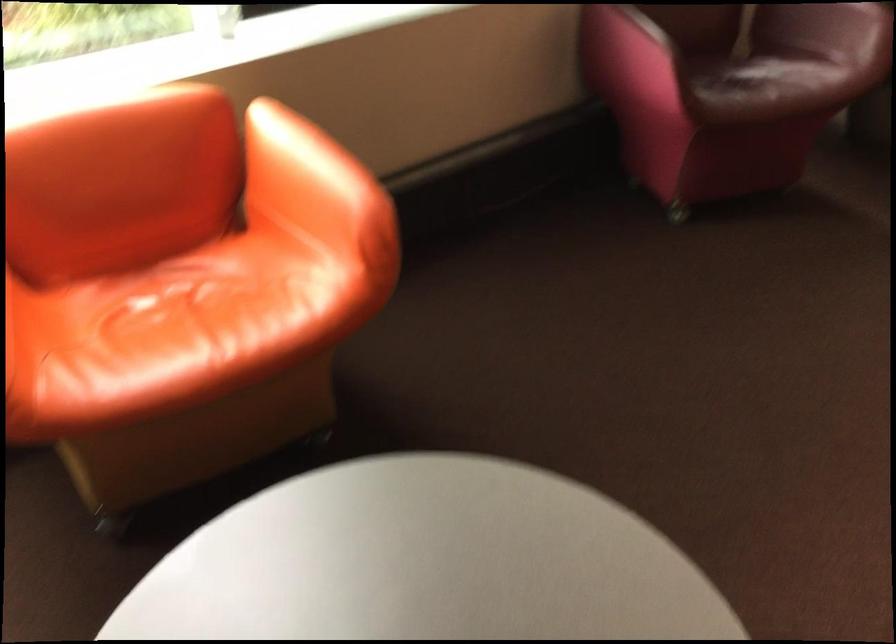
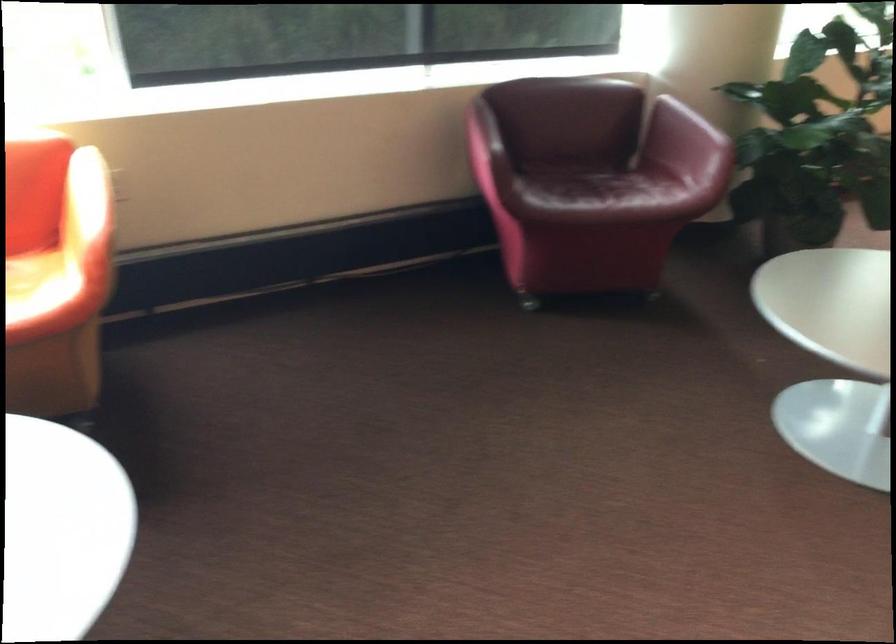
The point at [271,285] is marked in the first image. Where is the corresponding point in the second image?

(35, 285)